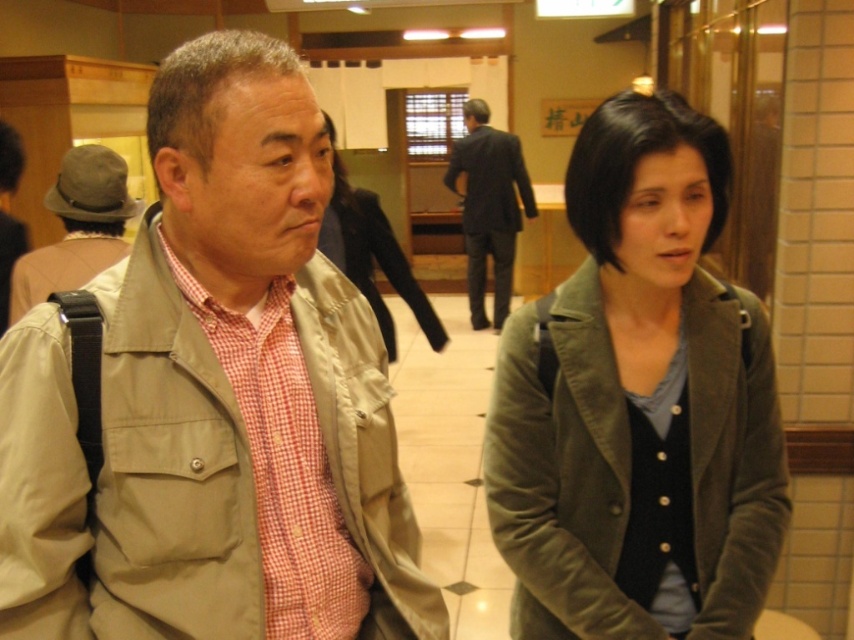
You are a tailor measuring jackets for alterations. You have two jackets in front of you, the khaki fabric jacket at center and the matte green jacket at center. Which jacket has a shorter length?

The khaki fabric jacket at center is shorter than the matte green jacket at center, so the khaki fabric jacket at center has the shorter length.

You are a photographer positioned at the entrance of the room. You want to take a photo that includes both the khaki fabric jacket at center and the matte green jacket at center. Given that your camera has a maximum focus range of 6 feet, will you be able to capture both jackets in focus without moving your position?

The khaki fabric jacket at center and matte green jacket at center are 6.38 feet apart from each other. Since the distance between them exceeds the camera maximum focus range of 6 feet, you cannot capture both jackets in focus without moving your position.